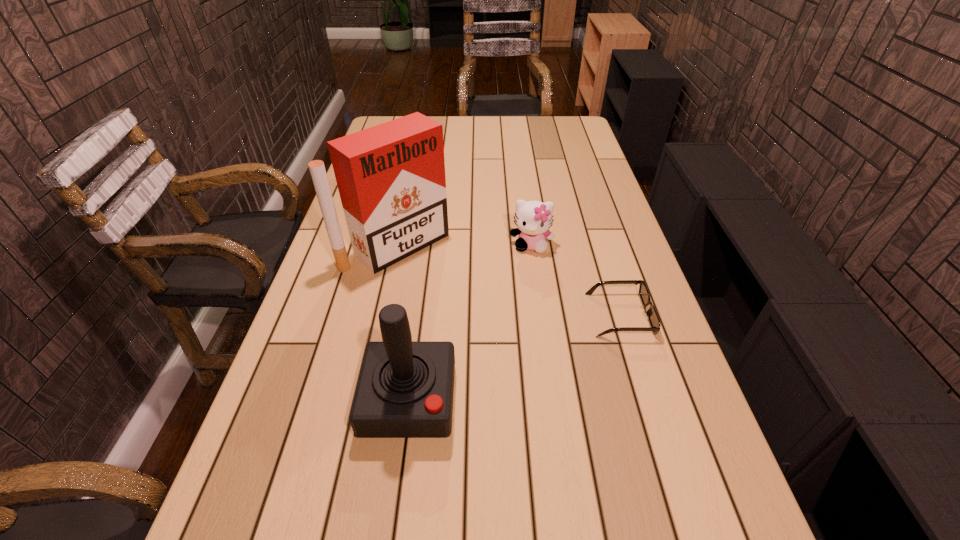
Identify the location of vacant spot on the desktop that is between the joystick and the rightmost object and is positioned on the front-facing side of the second object from right to left. (522, 354).

Where is `vacant space on the desktop that is between the nearest object and the sunglasses and is positioned on the front-facing side of the tallest object`? Image resolution: width=960 pixels, height=540 pixels. vacant space on the desktop that is between the nearest object and the sunglasses and is positioned on the front-facing side of the tallest object is located at coordinates (526, 353).